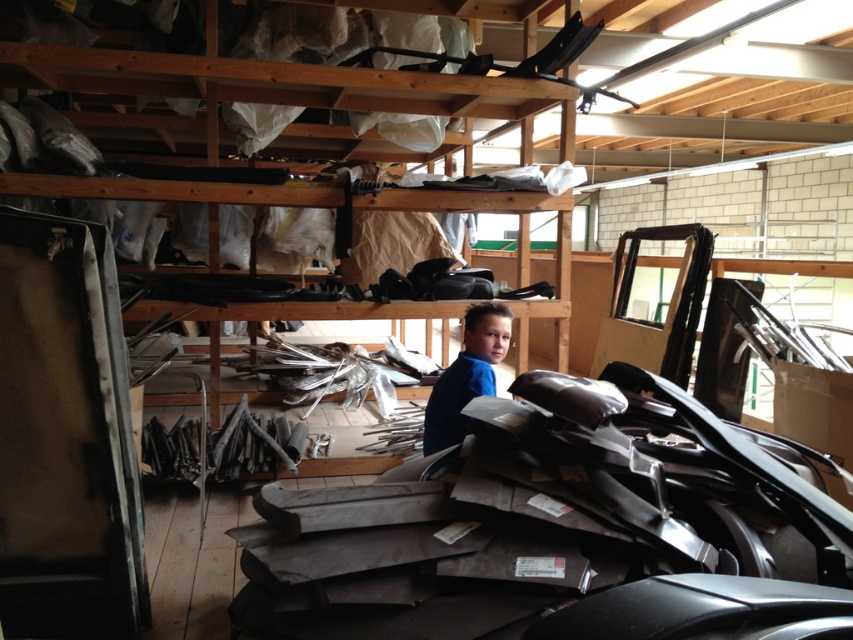
You are a delivery person who needs to place a large box that is 5 feet long in this storage area. You see the wooden shelves at center and the blue matte shirt at center. Can you fit the box horizontally between them?

The distance between the wooden shelves at center and the blue matte shirt at center is 5.16 feet, so the box that is 5 feet long can fit horizontally between them since it is shorter than the available space.

You are a worker in the workshop and need to retrieve an item from the wooden shelves at center. However, there is a blue matte shirt at center blocking your path. Based on their positions, can you walk around the obstruction to reach the shelves?

The wooden shelves at center is to the left of blue matte shirt at center, so you can walk around to the right side of the blue matte shirt at center to access the shelves.